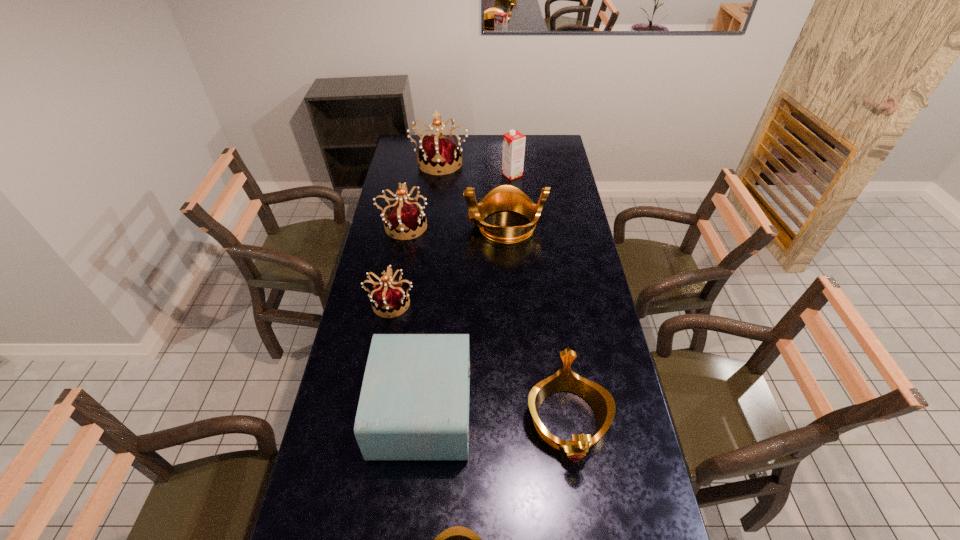
At what (x,y) coordinates should I click in order to perform the action: click on radio receiver located in the left edge section of the desktop. Please return your answer as a coordinate pair (x, y). The width and height of the screenshot is (960, 540). Looking at the image, I should click on (414, 403).

This screenshot has width=960, height=540. I want to click on object that is at the far left corner, so click(440, 153).

The image size is (960, 540). In the image, there is a desktop. What are the coordinates of `free region at the left edge` in the screenshot? It's located at (361, 356).

Identify the location of vacant space at the right edge of the desktop. (612, 423).

At what (x,y) coordinates should I click in order to perform the action: click on vacant area between the radio receiver and the carton. Please return your answer as a coordinate pair (x, y). The height and width of the screenshot is (540, 960). Looking at the image, I should click on (468, 292).

The width and height of the screenshot is (960, 540). Identify the location of free space between the second farthest gold tiara and the radio receiver. (495, 415).

Locate an element on the screen. The height and width of the screenshot is (540, 960). free area in between the second farthest red tiara and the second farthest gold tiara is located at coordinates (486, 323).

I want to click on free space between the smallest red tiara and the farthest gold tiara, so click(448, 264).

Find the location of a particular element. The width and height of the screenshot is (960, 540). free spot between the biggest gold tiara and the second nearest tiara is located at coordinates (536, 323).

The height and width of the screenshot is (540, 960). I want to click on empty location between the carton and the second biggest red tiara, so click(458, 200).